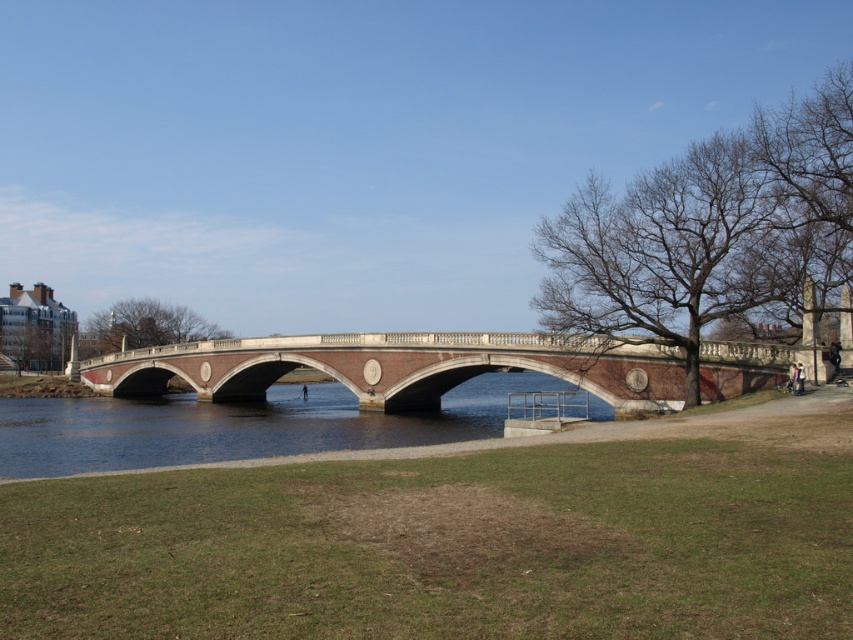
Question: Considering the real-world distances, which object is closest to the white fabric jacket at lower right?

Choices:
 (A) blue stone water at center
 (B) brick stone bridge at center
 (C) black matte person at center

Answer: (B)

Question: Can you confirm if blue stone water at center is wider than black matte person at center?

Choices:
 (A) yes
 (B) no

Answer: (A)

Question: Which object is positioned farthest from the white fabric jacket at lower right?

Choices:
 (A) brick stone bridge at center
 (B) blue stone water at center
 (C) black matte person at center

Answer: (C)

Question: Is white fabric jacket at lower right smaller than black matte person at center?

Choices:
 (A) yes
 (B) no

Answer: (A)

Question: Which of the following is the closest to the observer?

Choices:
 (A) black matte person at center
 (B) brick stone bridge at center

Answer: (B)

Question: Observing the image, what is the correct spatial positioning of brick stone bridge at center in reference to black matte person at center?

Choices:
 (A) above
 (B) below

Answer: (A)